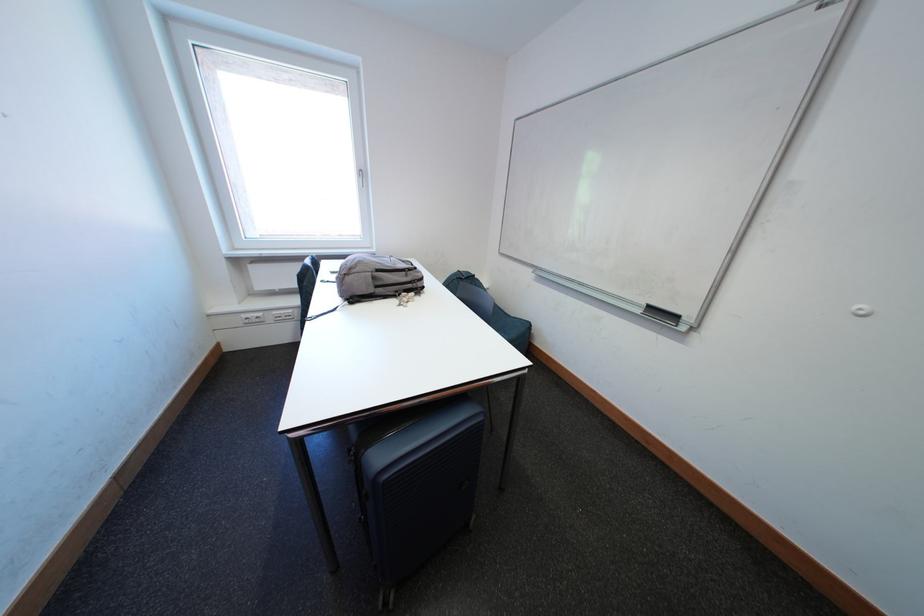
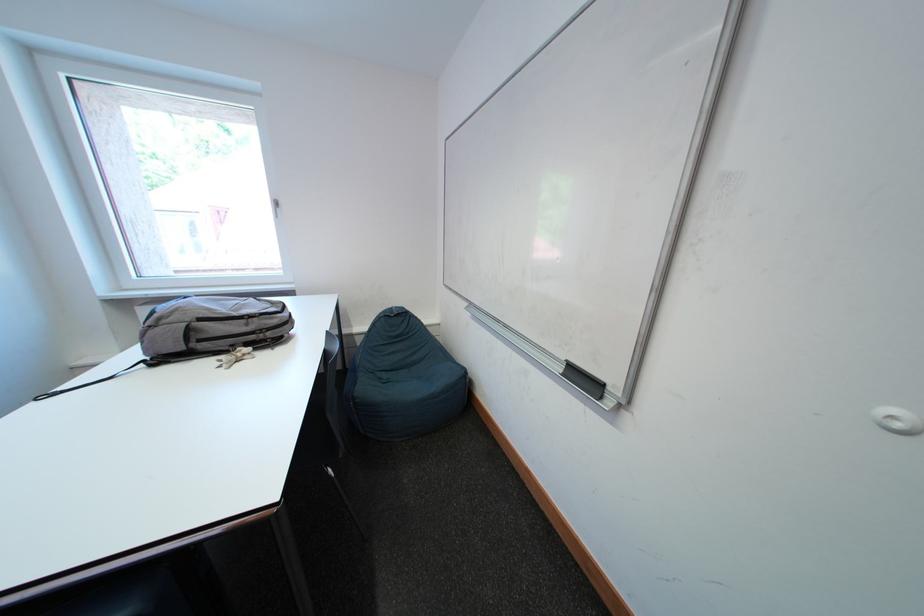
The images are taken continuously from a first-person perspective. In which direction are you moving?

The cameraman moved toward right, forward.